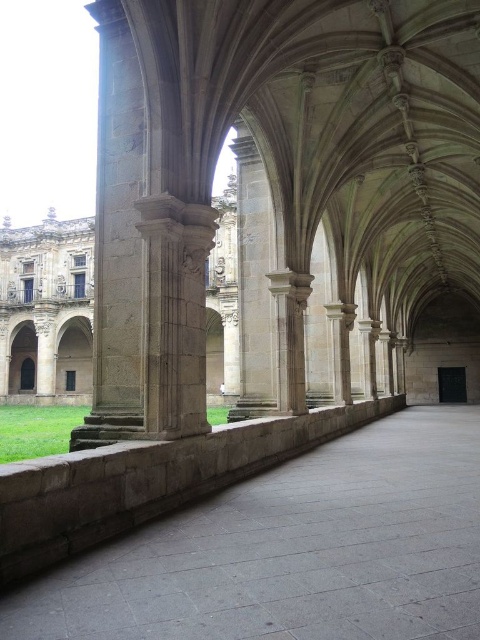
Question: Is brown stone ledge at lower left positioned behind brown stone column at center?

Choices:
 (A) yes
 (B) no

Answer: (B)

Question: Which of the following is the closest to the observer?

Choices:
 (A) brown stone column at center
 (B) smooth stone pillar at center
 (C) brown stone ledge at lower left

Answer: (C)

Question: Is brown stone ledge at lower left wider than smooth stone pillar at center?

Choices:
 (A) no
 (B) yes

Answer: (B)

Question: Among these points, which one is farthest from the camera?

Choices:
 (A) (50, 486)
 (B) (254, 250)

Answer: (B)

Question: Which object appears farthest from the camera in this image?

Choices:
 (A) brown stone column at center
 (B) smooth stone pillar at center

Answer: (A)

Question: Does brown stone column at center lie behind smooth stone pillar at center?

Choices:
 (A) yes
 (B) no

Answer: (A)